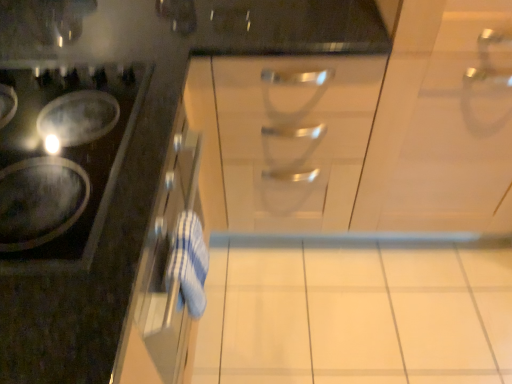
Question: Does satin silver drawer at center appear on the right side of white glossy cabinet at upper left, positioned as the first cabinetry in left-to-right order?

Choices:
 (A) no
 (B) yes

Answer: (B)

Question: Is the depth of satin silver drawer at center less than that of white glossy cabinet at upper left, the 2th cabinetry when ordered from right to left?

Choices:
 (A) no
 (B) yes

Answer: (A)

Question: From a real-world perspective, is satin silver drawer at center on white glossy cabinet at upper left, the 2th cabinetry when ordered from right to left?

Choices:
 (A) no
 (B) yes

Answer: (A)

Question: Considering the relative sizes of satin silver drawer at center and white glossy cabinet at upper left, the 2th cabinetry when ordered from right to left, in the image provided, is satin silver drawer at center smaller than white glossy cabinet at upper left, the 2th cabinetry when ordered from right to left,?

Choices:
 (A) no
 (B) yes

Answer: (A)

Question: Is satin silver drawer at center thinner than white glossy cabinet at upper left, the 2th cabinetry when ordered from right to left?

Choices:
 (A) no
 (B) yes

Answer: (A)

Question: Is white glossy cabinet at upper left, positioned as the first cabinetry in left-to-right order, situated inside white glossy cabinet at center, the first cabinetry positioned from the right, or outside?

Choices:
 (A) outside
 (B) inside

Answer: (A)

Question: From the image's perspective, is white glossy cabinet at upper left, the 2th cabinetry when ordered from right to left, positioned above or below white glossy cabinet at center, the first cabinetry positioned from the right?

Choices:
 (A) below
 (B) above

Answer: (A)

Question: Based on their positions, is white glossy cabinet at upper left, the 2th cabinetry when ordered from right to left, located to the left or right of white glossy cabinet at center, which is the second cabinetry in left-to-right order?

Choices:
 (A) right
 (B) left

Answer: (B)

Question: Is point (124, 312) closer or farther from the camera than point (433, 79)?

Choices:
 (A) closer
 (B) farther

Answer: (A)

Question: From a real-world perspective, is white glossy cabinet at upper left, the 2th cabinetry when ordered from right to left, above or below shiny black cooktop at left?

Choices:
 (A) above
 (B) below

Answer: (B)

Question: In terms of size, does white glossy cabinet at upper left, the 2th cabinetry when ordered from right to left, appear bigger or smaller than shiny black cooktop at left?

Choices:
 (A) small
 (B) big

Answer: (B)

Question: In terms of height, does white glossy cabinet at upper left, the 2th cabinetry when ordered from right to left, look taller or shorter compared to shiny black cooktop at left?

Choices:
 (A) short
 (B) tall

Answer: (B)

Question: From the image's perspective, is white glossy cabinet at upper left, the 2th cabinetry when ordered from right to left, above or below shiny black cooktop at left?

Choices:
 (A) below
 (B) above

Answer: (A)

Question: Considering the positions of shiny black cooktop at left and white glossy cabinet at upper left, the 2th cabinetry when ordered from right to left, in the image, is shiny black cooktop at left wider or thinner than white glossy cabinet at upper left, the 2th cabinetry when ordered from right to left,?

Choices:
 (A) wide
 (B) thin

Answer: (B)

Question: In terms of size, does shiny black cooktop at left appear bigger or smaller than white glossy cabinet at upper left, the 2th cabinetry when ordered from right to left?

Choices:
 (A) small
 (B) big

Answer: (A)